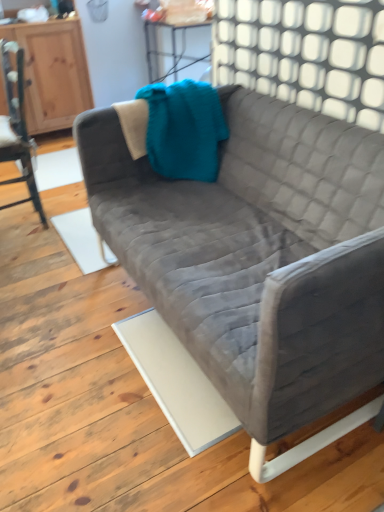
Question: From the image's perspective, is wooden dresser at left above or below white textured wall at upper center?

Choices:
 (A) below
 (B) above

Answer: (B)

Question: Based on their positions, is wooden dresser at left located to the left or right of white textured wall at upper center?

Choices:
 (A) left
 (B) right

Answer: (A)

Question: Estimate the real-world distances between objects in this image. Which object is farther from the wooden dresser at left?

Choices:
 (A) white textured wall at upper center
 (B) velvet gray couch at center
 (C) wooden chair at left

Answer: (B)

Question: Which of these objects is positioned closest to the velvet gray couch at center?

Choices:
 (A) white textured wall at upper center
 (B) wooden chair at left
 (C) wooden dresser at left

Answer: (A)